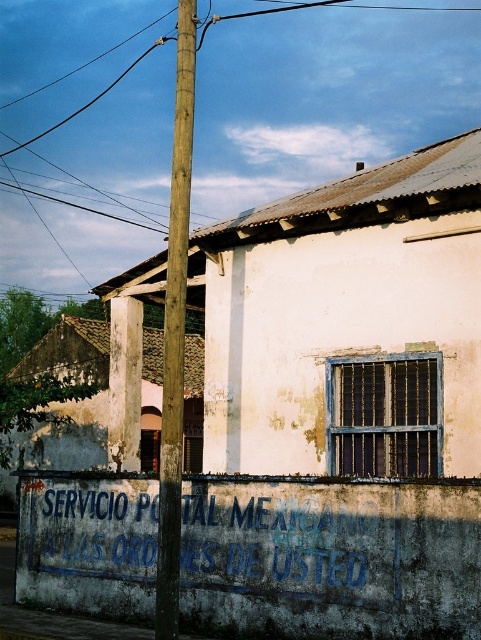
Based on the photo, you are standing in front of the building and notice two points marked on the wall. Which point is closer to you, point (x=372, y=531) or point (x=163, y=481)?

Point (x=372, y=531) is further to the viewer than point (x=163, y=481), so point (x=163, y=481) is closer to you.

You are a postal worker delivering a package and need to find the entrance to the building. You see the blue faded graffiti at lower center and the wooden telegraph pole at center. Which object is closer to the entrance of the building?

The wooden telegraph pole at center is closer to the entrance of the building because the blue faded graffiti at lower center is to the right of it, meaning the pole is positioned between the graffiti and the building entrance.